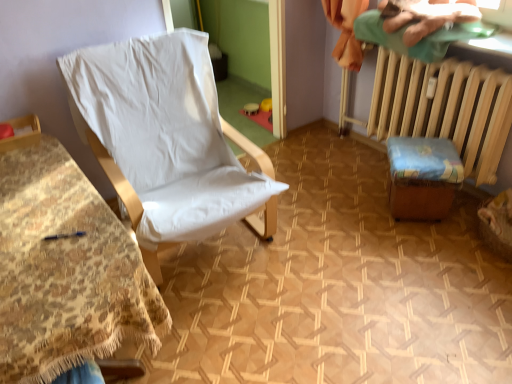
Locate an element on the screen. This screenshot has height=384, width=512. vacant space situated on the left part of wooden radiator at right is located at coordinates (328, 177).